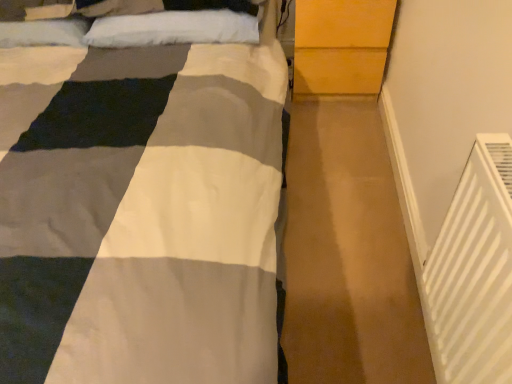
This screenshot has height=384, width=512. Identify the location of free space in front of light brown wood dresser at upper right. (336, 128).